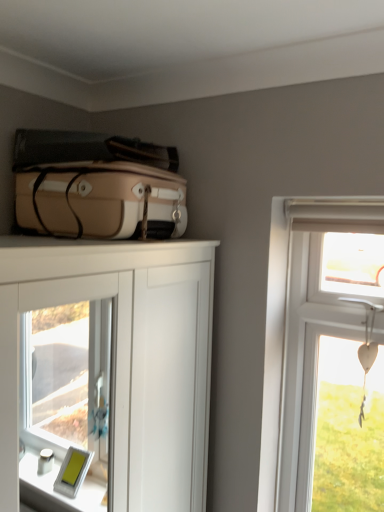
Question: Considering the relative positions of white glossy cabinet at center and white wooden heart at upper right in the image provided, is white glossy cabinet at center to the right of white wooden heart at upper right from the viewer's perspective?

Choices:
 (A) no
 (B) yes

Answer: (A)

Question: Can you confirm if white glossy cabinet at center is taller than white wooden heart at upper right?

Choices:
 (A) yes
 (B) no

Answer: (B)

Question: Considering the relative sizes of white glossy cabinet at center and white wooden heart at upper right in the image provided, is white glossy cabinet at center smaller than white wooden heart at upper right?

Choices:
 (A) no
 (B) yes

Answer: (A)

Question: Are white glossy cabinet at center and white wooden heart at upper right far apart?

Choices:
 (A) no
 (B) yes

Answer: (B)

Question: Is white glossy cabinet at center touching white wooden heart at upper right?

Choices:
 (A) yes
 (B) no

Answer: (B)

Question: Considering the positions of point (309, 240) and point (71, 198), is point (309, 240) closer or farther from the camera than point (71, 198)?

Choices:
 (A) closer
 (B) farther

Answer: (B)

Question: Considering the positions of white wooden heart at upper right and matte beige suitcase at upper left in the image, is white wooden heart at upper right wider or thinner than matte beige suitcase at upper left?

Choices:
 (A) thin
 (B) wide

Answer: (A)

Question: Is white wooden heart at upper right spatially inside matte beige suitcase at upper left, or outside of it?

Choices:
 (A) outside
 (B) inside

Answer: (A)

Question: Based on their positions, is white wooden heart at upper right located to the left or right of matte beige suitcase at upper left?

Choices:
 (A) right
 (B) left

Answer: (A)

Question: Considering the positions of white glossy cabinet at center and white wooden heart at upper right in the image, is white glossy cabinet at center taller or shorter than white wooden heart at upper right?

Choices:
 (A) tall
 (B) short

Answer: (B)

Question: From the image's perspective, is white glossy cabinet at center positioned above or below white wooden heart at upper right?

Choices:
 (A) above
 (B) below

Answer: (B)

Question: From a real-world perspective, is white glossy cabinet at center above or below white wooden heart at upper right?

Choices:
 (A) above
 (B) below

Answer: (B)

Question: Considering their positions, is white glossy cabinet at center located in front of or behind white wooden heart at upper right?

Choices:
 (A) front
 (B) behind

Answer: (A)

Question: From the image's perspective, relative to white glossy cabinet at center, is white wooden heart at upper right above or below?

Choices:
 (A) below
 (B) above

Answer: (B)

Question: Is white wooden heart at upper right taller or shorter than white glossy cabinet at center?

Choices:
 (A) tall
 (B) short

Answer: (A)